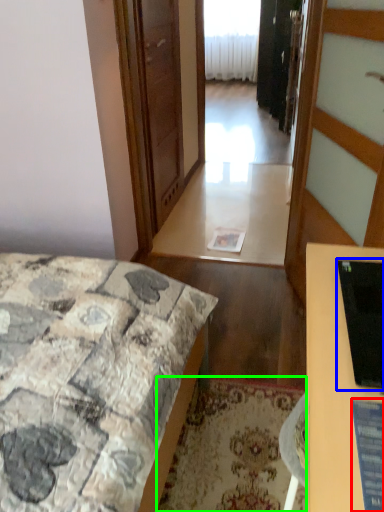
Question: Which is nearer to the computer screen (highlighted by a red box)? computer monitor (highlighted by a blue box) or mat (highlighted by a green box).

Choices:
 (A) computer monitor
 (B) mat

Answer: (A)